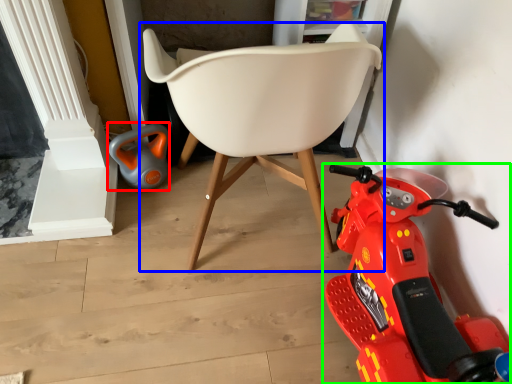
Question: Considering the real-world distances, which object is closest to toy (highlighted by a red box)? chair (highlighted by a blue box) or land vehicle (highlighted by a green box).

Choices:
 (A) chair
 (B) land vehicle

Answer: (A)